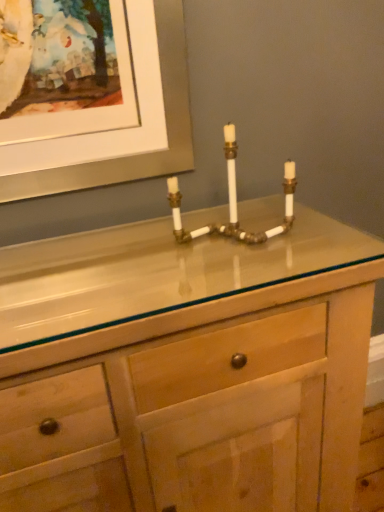
The width and height of the screenshot is (384, 512). I want to click on free region on the left part of brass/bronze pipe at center, so click(x=147, y=253).